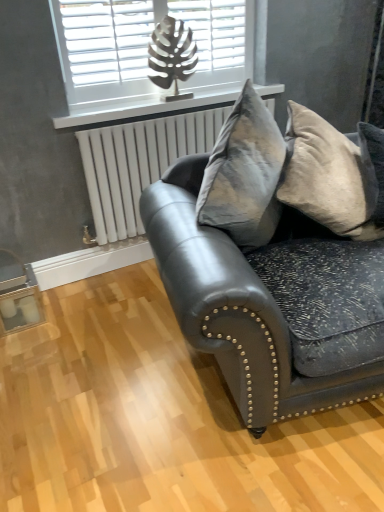
Find the location of a particular element. vacant area on top of white plastic radiator at upper center (from a real-world perspective) is located at coordinates point(159,101).